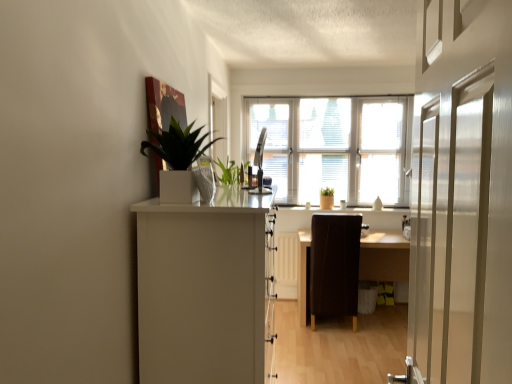
Identify the location of free space in front of wooden table at center. tap(358, 345).